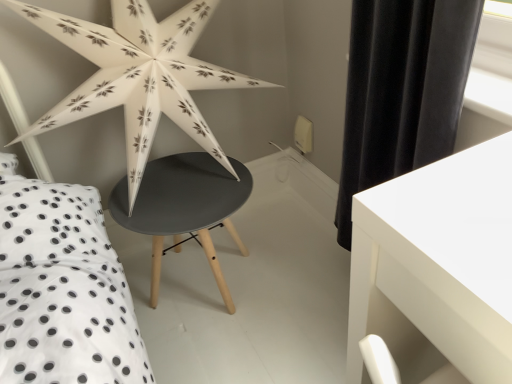
Question: In terms of width, does white paper star at upper left look wider or thinner when compared to matte black table at center, which is the first table from back to front?

Choices:
 (A) wide
 (B) thin

Answer: (B)

Question: Choose the correct answer: Is white paper star at upper left inside matte black table at center, which is the first table from back to front, or outside it?

Choices:
 (A) outside
 (B) inside

Answer: (A)

Question: Which is nearer to the white paper star at upper left?

Choices:
 (A) matte black table at center, which is the 2th table from front to back
 (B) white glossy table at lower right, the first table in the front-to-back sequence

Answer: (A)

Question: Considering the real-world distances, which object is closest to the matte black table at center, arranged as the second table when viewed from the right?

Choices:
 (A) white glossy table at lower right, the 2th table positioned from the back
 (B) white paper star at upper left

Answer: (B)